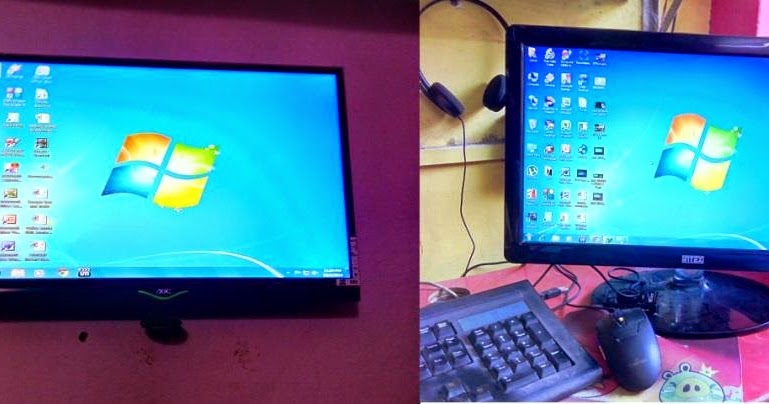
The width and height of the screenshot is (769, 404). In order to click on wall in this screenshot , I will do `click(484, 188)`, `click(463, 57)`, `click(355, 36)`, `click(50, 358)`.